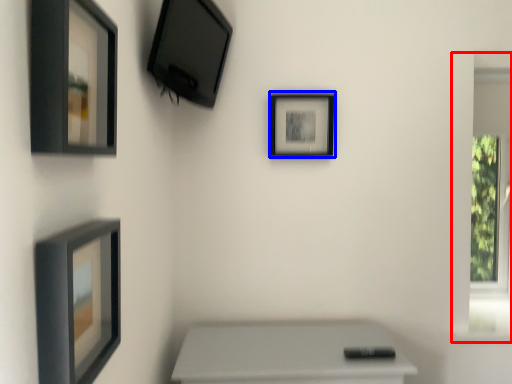
Question: Which point is further to the camera, window frame (highlighted by a red box) or picture frame (highlighted by a blue box)?

Choices:
 (A) window frame
 (B) picture frame

Answer: (A)